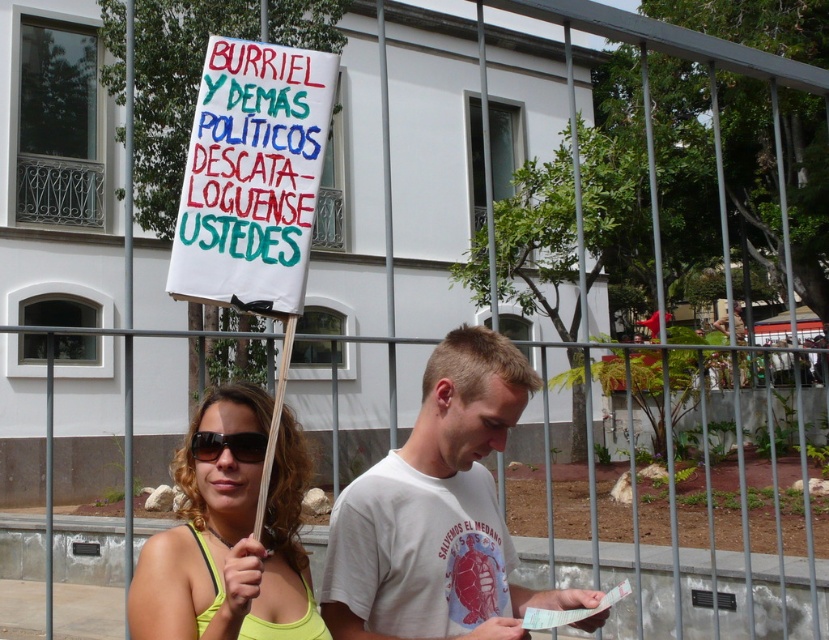
Question: Is white cotton t-shirt at center thinner than white paper sign at center?

Choices:
 (A) yes
 (B) no

Answer: (B)

Question: Which of these objects is positioned farthest from the black plastic goggles at center?

Choices:
 (A) yellow-green fabric at center
 (B) white cotton t-shirt at center

Answer: (B)

Question: Which object is the farthest from the white paper sign at center?

Choices:
 (A) black plastic goggles at center
 (B) yellow-green fabric at center
 (C) white cotton t-shirt at center

Answer: (C)

Question: Is white cotton t-shirt at center further to camera compared to black plastic goggles at center?

Choices:
 (A) yes
 (B) no

Answer: (A)

Question: Which object appears farthest from the camera in this image?

Choices:
 (A) black plastic goggles at center
 (B) white paper sign at center
 (C) yellow-green fabric at center
 (D) white cotton t-shirt at center

Answer: (B)

Question: Does white cotton t-shirt at center have a greater width compared to white paper sign at center?

Choices:
 (A) yes
 (B) no

Answer: (A)